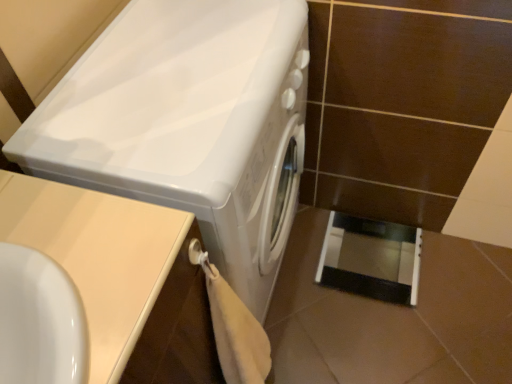
At what (x,y) coordinates should I click in order to perform the action: click on free space to the left of black glossy screen door at lower right. Please return your answer as a coordinate pair (x, y). Image resolution: width=512 pixels, height=384 pixels. Looking at the image, I should click on (305, 283).